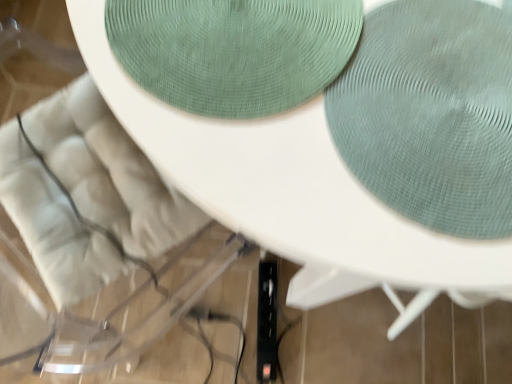
This screenshot has width=512, height=384. In order to click on free location to the right of green textured placemat at upper center in this screenshot , I will do `click(441, 100)`.